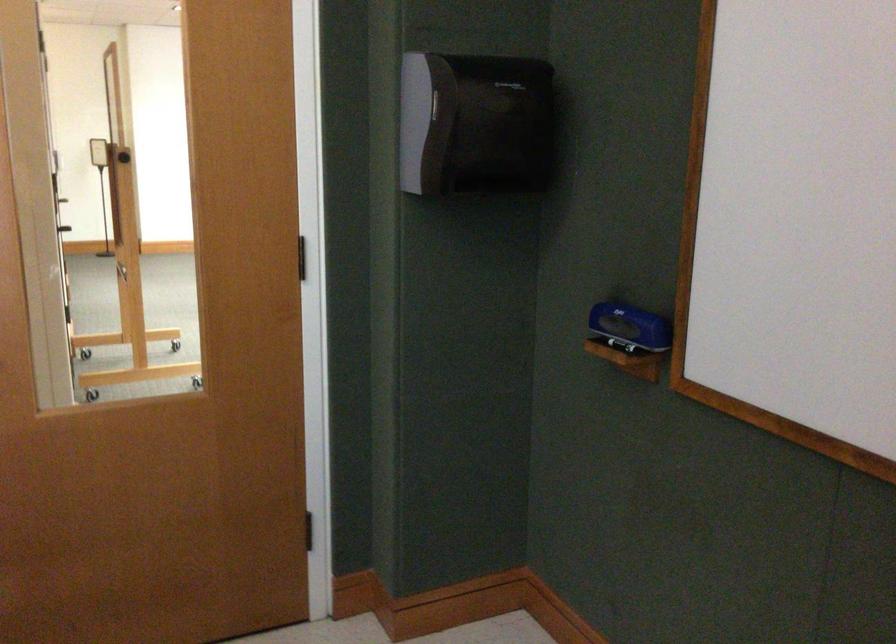
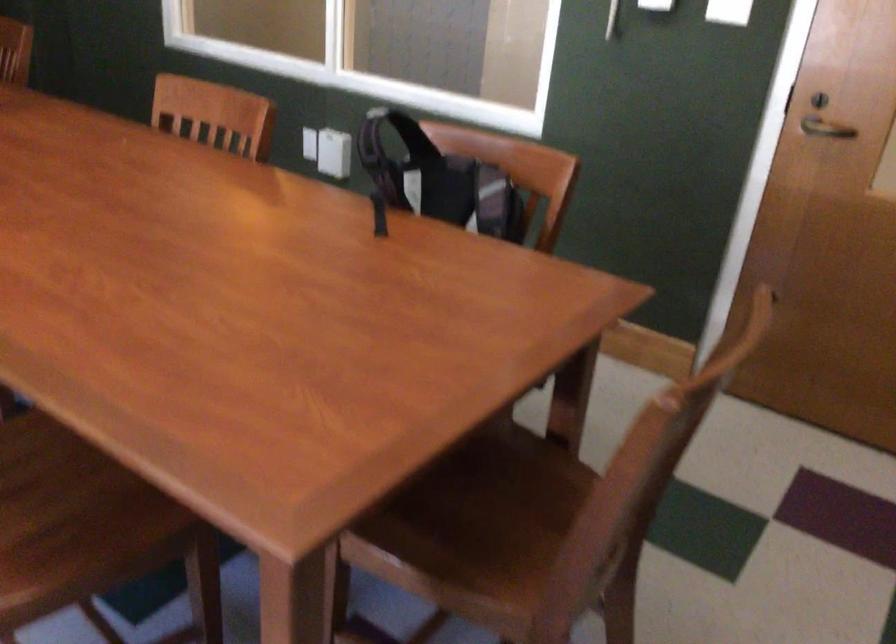
How did the camera likely rotate?

The camera's rotation is toward left-down.